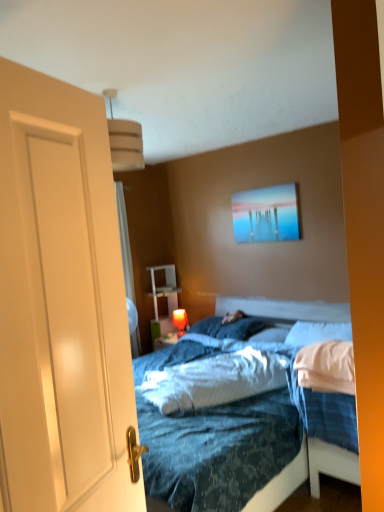
Question: Relative to blue soft pillow at center, positioned as the 2th pillow in left-to-right order, is white soft pillow at right, the 1th pillow positioned from the right, in front or behind?

Choices:
 (A) front
 (B) behind

Answer: (A)

Question: From a real-world perspective, is white soft pillow at right, the 1th pillow positioned from the right, physically located above or below blue soft pillow at center, positioned as the 2th pillow in left-to-right order?

Choices:
 (A) below
 (B) above

Answer: (B)

Question: Which is nearer to the matte orange lampshade at center?

Choices:
 (A) blue textured mattress at center
 (B) blue soft pillow at center, acting as the first pillow starting from the left
 (C) metallic glossy picture frame at upper center
 (D) blue soft pillow at center, placed as the 2th pillow when sorted from right to left
 (E) white soft pillow at right, the 1th pillow positioned from the right

Answer: (B)

Question: Which object is the farthest from the white soft pillow at right, which is the third pillow in left-to-right order?

Choices:
 (A) blue textured mattress at center
 (B) blue soft pillow at center, the 3th pillow positioned from the right
 (C) metallic glossy picture frame at upper center
 (D) wooden bed frame at center
 (E) white matte door at left

Answer: (E)